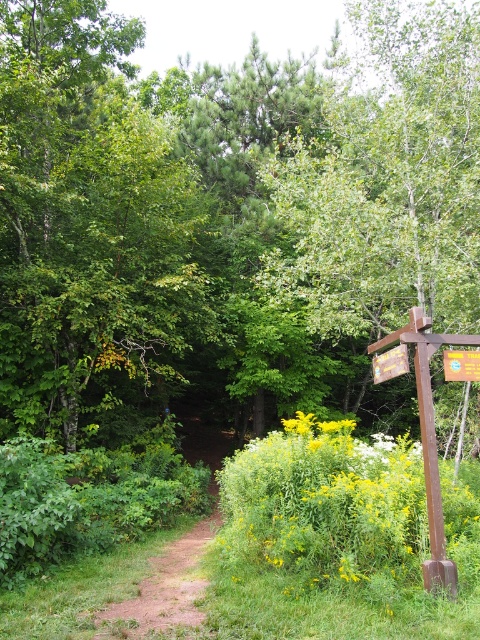
Question: Observing the image, what is the correct spatial positioning of wooden signpost at right in reference to yellow plastic sign at right?

Choices:
 (A) right
 (B) left

Answer: (B)

Question: Which object is the farthest from the wooden signpost at right?

Choices:
 (A) yellow plastic sign at right
 (B) dirt path at center
 (C) yellow matte flowers at right
 (D) wooden sign at right

Answer: (B)

Question: Considering the relative positions of yellow matte flowers at right and wooden sign at right in the image provided, where is yellow matte flowers at right located with respect to wooden sign at right?

Choices:
 (A) right
 (B) left

Answer: (B)

Question: Which point appears closest to the camera in this image?

Choices:
 (A) (464, 378)
 (B) (373, 561)

Answer: (B)

Question: Which of the following is the farthest from the observer?

Choices:
 (A) wooden sign at right
 (B) wooden signpost at right

Answer: (A)

Question: Does yellow matte flowers at right have a larger size compared to wooden sign at right?

Choices:
 (A) no
 (B) yes

Answer: (B)